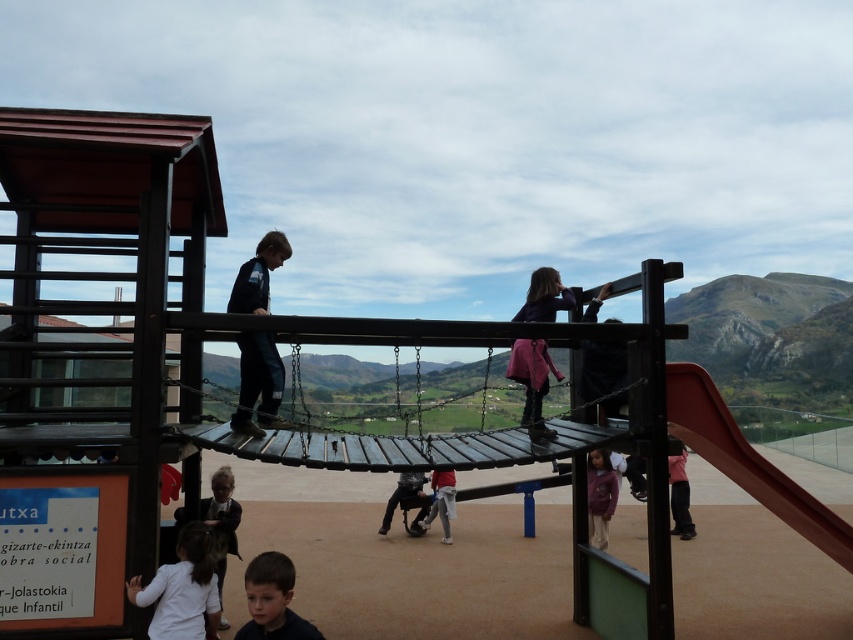
You are a parent at the playground and you see two children wearing different colored fabrics. The first child is wearing dark blue fabric at upper right and the second child is wearing pink fabric pants at lower right. Which child is standing higher up?

The dark blue fabric at upper right is taller than pink fabric pants at lower right, so the child wearing dark blue fabric at upper right is standing higher up.

You are a parent at the playground and notice two children wearing the purple fleece jacket at lower center and the pink fabric pants at lower right. Which child would you estimate is taller?

The purple fleece jacket at lower center is larger in size compared to the pink fabric pants at lower right, so the child wearing the purple fleece jacket at lower center is likely taller than the one in the pink fabric pants at lower right.